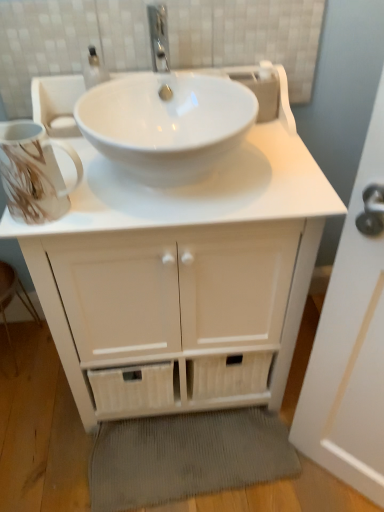
Find the location of `white matte cabinet at center`. white matte cabinet at center is located at coordinates (186, 267).

The width and height of the screenshot is (384, 512). In order to click on wooden step stool at lower left in this screenshot , I will do pyautogui.click(x=12, y=298).

Is wooden step stool at lower left shorter than white matte cabinet at center?

Yes, wooden step stool at lower left is shorter than white matte cabinet at center.

Where is `bathroom cabinet in front of the wooden step stool at lower left`? This screenshot has height=512, width=384. bathroom cabinet in front of the wooden step stool at lower left is located at coordinates (186, 267).

Between wooden step stool at lower left and white matte cabinet at center, which one has larger size?

With larger size is white matte cabinet at center.

Is wooden step stool at lower left far from white matte cabinet at center?

No, wooden step stool at lower left is in close proximity to white matte cabinet at center.

Does point (235, 76) lie behind point (256, 464)?

No, (235, 76) is closer to viewer.

Who is shorter, white matte cabinet at center or gray corduroy bath mat at lower center?

gray corduroy bath mat at lower center is shorter.

Does white matte cabinet at center have a larger size compared to gray corduroy bath mat at lower center?

Yes, white matte cabinet at center is bigger than gray corduroy bath mat at lower center.

Is white matte cabinet at center positioned with its back to gray corduroy bath mat at lower center?

No.

Is wooden step stool at lower left positioned behind gray corduroy bath mat at lower center?

Yes, the depth of wooden step stool at lower left is greater than that of gray corduroy bath mat at lower center.

Is point (3, 286) positioned after point (268, 429)?

Yes, point (3, 286) is farther from viewer.

How distant is wooden step stool at lower left from gray corduroy bath mat at lower center?

A distance of 28.76 inches exists between wooden step stool at lower left and gray corduroy bath mat at lower center.

Is wooden step stool at lower left to the right of gray corduroy bath mat at lower center from the viewer's perspective?

No, wooden step stool at lower left is not to the right of gray corduroy bath mat at lower center.

Is white matte cabinet at center aimed at wooden step stool at lower left?

No, white matte cabinet at center is not oriented towards wooden step stool at lower left.

Is white matte cabinet at center bigger than wooden step stool at lower left?

Correct, white matte cabinet at center is larger in size than wooden step stool at lower left.

Where is `bathroom cabinet above the wooden step stool at lower left (from a real-world perspective)`? This screenshot has height=512, width=384. bathroom cabinet above the wooden step stool at lower left (from a real-world perspective) is located at coordinates (186, 267).

From the image's perspective, who appears lower, white matte cabinet at center or wooden step stool at lower left?

From the image's view, wooden step stool at lower left is below.

Considering the relative sizes of gray corduroy bath mat at lower center and white matte cabinet at center in the image provided, is gray corduroy bath mat at lower center shorter than white matte cabinet at center?

Yes.

Between gray corduroy bath mat at lower center and white matte cabinet at center, which one has smaller size?

Smaller between the two is gray corduroy bath mat at lower center.

Which point is more distant from viewer, (115, 490) or (270, 239)?

Point (115, 490)

Is gray corduroy bath mat at lower center facing towards wooden step stool at lower left?

No, gray corduroy bath mat at lower center is not turned towards wooden step stool at lower left.

From a real-world perspective, is gray corduroy bath mat at lower center under wooden step stool at lower left?

Yes, from a real-world perspective, gray corduroy bath mat at lower center is below wooden step stool at lower left.

This screenshot has width=384, height=512. In order to click on bath mat in front of the wooden step stool at lower left in this screenshot , I will do `click(186, 457)`.

From the image's perspective, between gray corduroy bath mat at lower center and wooden step stool at lower left, who is located below?

gray corduroy bath mat at lower center appears lower in the image.

What are the coordinates of `bathroom cabinet that is on the right side of wooden step stool at lower left` in the screenshot? It's located at (186, 267).

Locate an element on the screen. bathroom cabinet above the gray corduroy bath mat at lower center (from the image's perspective) is located at coordinates (186, 267).

Estimate the real-world distances between objects in this image. Which object is closer to gray corduroy bath mat at lower center, white matte cabinet at center or wooden step stool at lower left?

The object closer to gray corduroy bath mat at lower center is white matte cabinet at center.

Looking at the image, which one is located closer to wooden step stool at lower left, white matte cabinet at center or gray corduroy bath mat at lower center?

The object closer to wooden step stool at lower left is gray corduroy bath mat at lower center.

Based on their spatial positions, is gray corduroy bath mat at lower center or wooden step stool at lower left further from white matte cabinet at center?

Among the two, wooden step stool at lower left is located further to white matte cabinet at center.

Looking at the image, which one is located closer to gray corduroy bath mat at lower center, wooden step stool at lower left or white matte cabinet at center?

white matte cabinet at center lies closer to gray corduroy bath mat at lower center than the other object.

Looking at the image, which one is located further to wooden step stool at lower left, gray corduroy bath mat at lower center or white matte cabinet at center?

white matte cabinet at center is positioned further to the anchor wooden step stool at lower left.

Estimate the real-world distances between objects in this image. Which object is closer to white matte cabinet at center, wooden step stool at lower left or gray corduroy bath mat at lower center?

gray corduroy bath mat at lower center is closer to white matte cabinet at center.

Identify the location of bathroom cabinet between wooden step stool at lower left and gray corduroy bath mat at lower center. The image size is (384, 512). (186, 267).